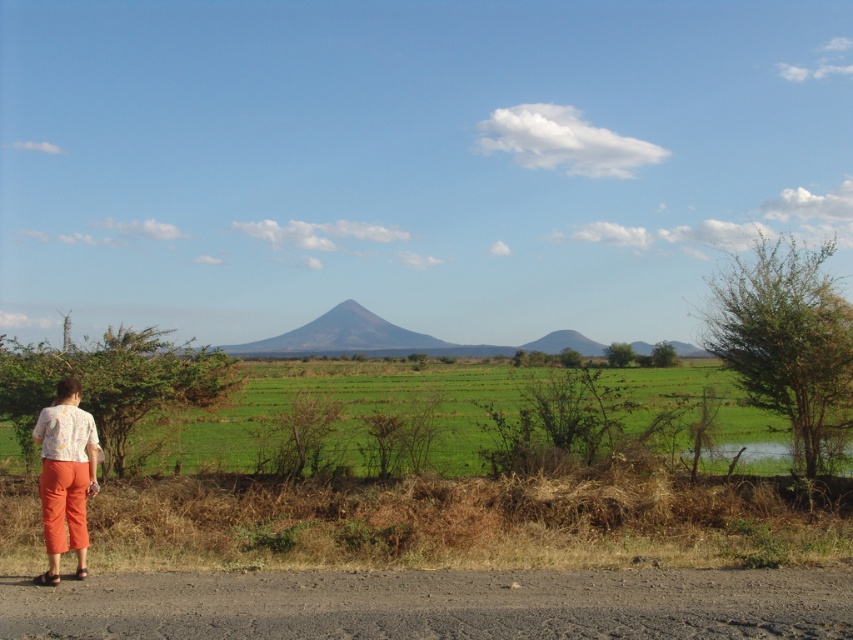
Question: Is green grassy field at center positioned before floral fabric blouse at lower left?

Choices:
 (A) no
 (B) yes

Answer: (A)

Question: Which point appears closest to the camera in this image?

Choices:
 (A) (61, 381)
 (B) (274, 388)

Answer: (A)

Question: Is green grassy field at center above floral fabric blouse at lower left?

Choices:
 (A) no
 (B) yes

Answer: (A)

Question: Does green grassy field at center have a lesser width compared to floral fabric blouse at lower left?

Choices:
 (A) no
 (B) yes

Answer: (A)